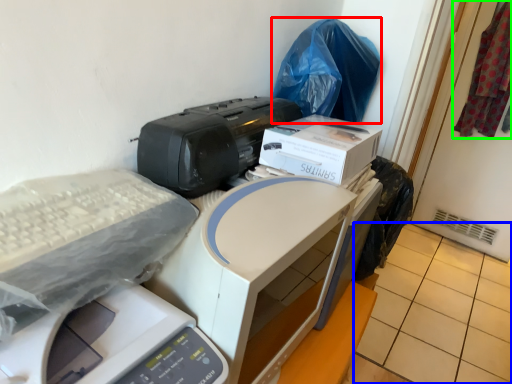
Question: Which object is positioned farthest from garbage (highlighted by a red box)? Select from tile (highlighted by a blue box) and material (highlighted by a green box).

Choices:
 (A) tile
 (B) material

Answer: (B)